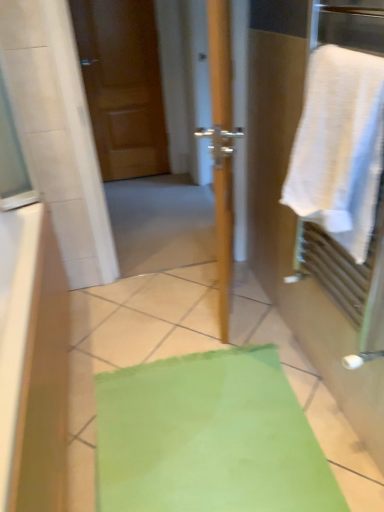
Question: Would you say matte wood door at upper left is outside white cotton towel at right?

Choices:
 (A) yes
 (B) no

Answer: (A)

Question: Is the depth of matte wood door at upper left less than that of white cotton towel at right?

Choices:
 (A) yes
 (B) no

Answer: (B)

Question: Is matte wood door at upper left positioned behind white cotton towel at right?

Choices:
 (A) no
 (B) yes

Answer: (B)

Question: Is matte wood door at upper left thinner than white cotton towel at right?

Choices:
 (A) yes
 (B) no

Answer: (A)

Question: Does matte wood door at upper left have a smaller size compared to white cotton towel at right?

Choices:
 (A) no
 (B) yes

Answer: (A)

Question: Can you confirm if matte wood door at upper left is bigger than white cotton towel at right?

Choices:
 (A) no
 (B) yes

Answer: (B)

Question: From the image's perspective, would you say white cotton towel at right is shown under matte wood door at upper left?

Choices:
 (A) yes
 (B) no

Answer: (A)

Question: Can you confirm if white cotton towel at right is bigger than matte wood door at upper left?

Choices:
 (A) yes
 (B) no

Answer: (B)

Question: Does white cotton towel at right appear on the right side of matte wood door at upper left?

Choices:
 (A) yes
 (B) no

Answer: (A)

Question: Is white cotton towel at right not within matte wood door at upper left?

Choices:
 (A) no
 (B) yes

Answer: (B)

Question: Is white cotton towel at right positioned far away from matte wood door at upper left?

Choices:
 (A) yes
 (B) no

Answer: (A)

Question: From a real-world perspective, is white cotton towel at right positioned under matte wood door at upper left based on gravity?

Choices:
 (A) yes
 (B) no

Answer: (B)

Question: Is wooden door at center surrounding matte wood door at upper left?

Choices:
 (A) yes
 (B) no

Answer: (B)